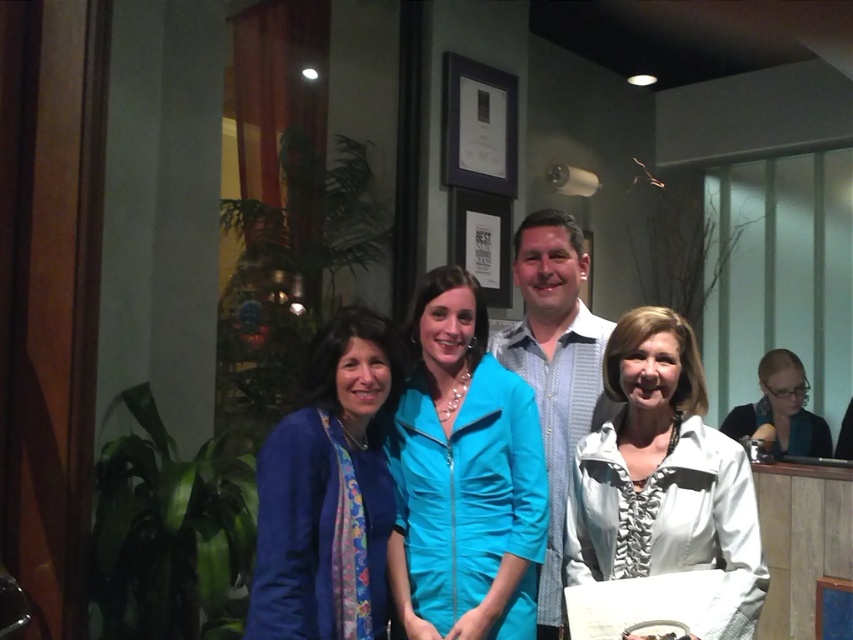
Question: Estimate the real-world distances between objects in this image. Which object is closer to the matte blue jacket at left?

Choices:
 (A) light blue shirt at center
 (B) white textured jacket at lower right
 (C) matte black jacket at lower right
 (D) turquoise fabric jacket at center

Answer: (D)

Question: Among these points, which one is farthest from the camera?

Choices:
 (A) (799, 444)
 (B) (502, 600)

Answer: (A)

Question: Which point is farther to the camera?

Choices:
 (A) matte blue jacket at left
 (B) light blue shirt at center

Answer: (B)

Question: Does white textured jacket at lower right have a lesser width compared to matte black jacket at lower right?

Choices:
 (A) yes
 (B) no

Answer: (A)

Question: Can you confirm if white textured jacket at lower right is smaller than matte black jacket at lower right?

Choices:
 (A) yes
 (B) no

Answer: (A)

Question: Can you confirm if white textured jacket at lower right is positioned above matte blue jacket at left?

Choices:
 (A) no
 (B) yes

Answer: (A)